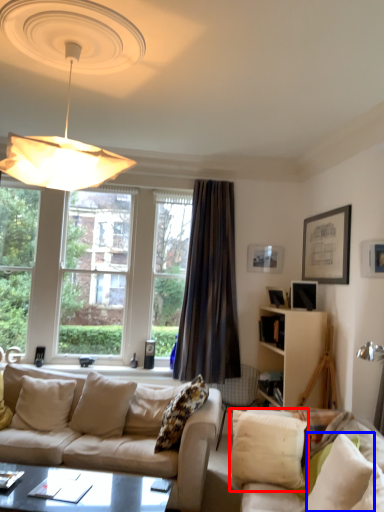
Question: Among these objects, which one is farthest to the camera, pillow (highlighted by a red box) or pillow (highlighted by a blue box)?

Choices:
 (A) pillow
 (B) pillow

Answer: (A)